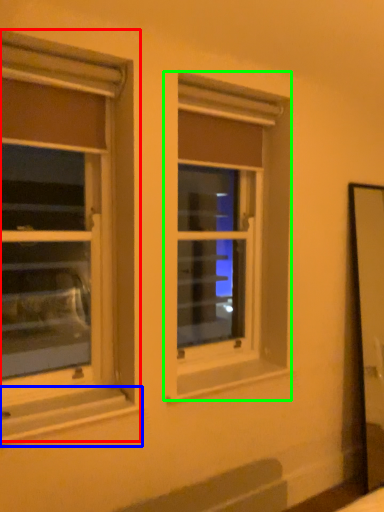
Question: Which object is the closest to the window (highlighted by a red box)? Choose among these: window sill (highlighted by a blue box) or window (highlighted by a green box).

Choices:
 (A) window sill
 (B) window

Answer: (B)